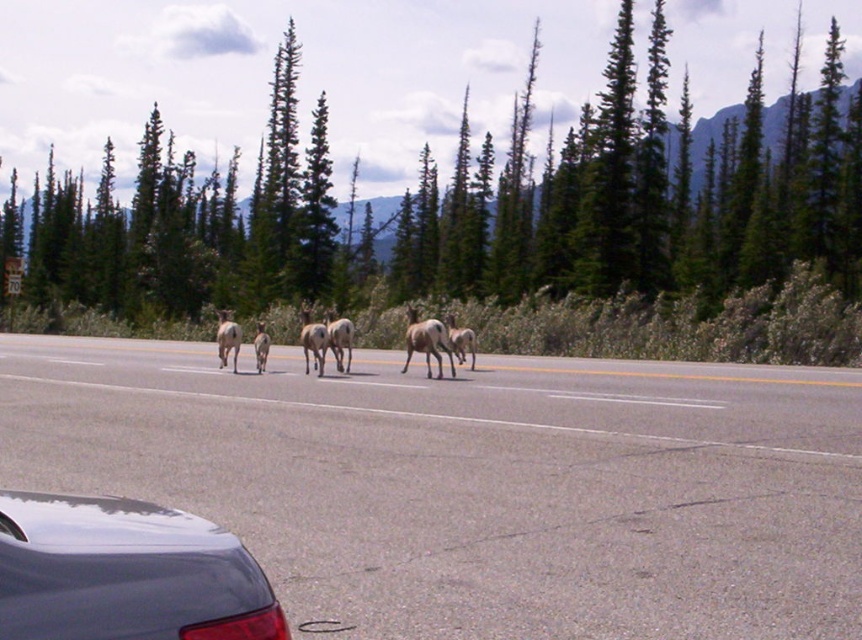
In the scene shown: You are a deer crossing the gray asphalt highway at center. You see the glossy dark blue car at lower left approaching. Can you safely cross the highway before the car reaches you?

The gray asphalt highway at center is wider than the glossy dark blue car at lower left, so the deer can safely cross the highway before the car reaches them.

You are driving a car and see the point marked at coordinates (475,484) on your GPS. What is the location of this point relative to the gray asphalt highway at center?

The point marked at coordinates (475,484) is located on the gray asphalt highway at center, as indicated by the description.

You are a driver approaching the gray asphalt highway at center and see the glossy dark blue car at lower left in your rearview mirror. Which object appears larger in your field of view?

The gray asphalt highway at center appears larger in your field of view because it is taller than the glossy dark blue car at lower left.